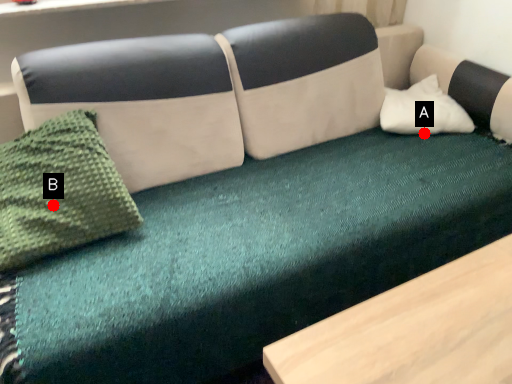
Question: Two points are circled on the image, labeled by A and B beside each circle. Which point is closer to the camera?

Choices:
 (A) A is closer
 (B) B is closer

Answer: (B)